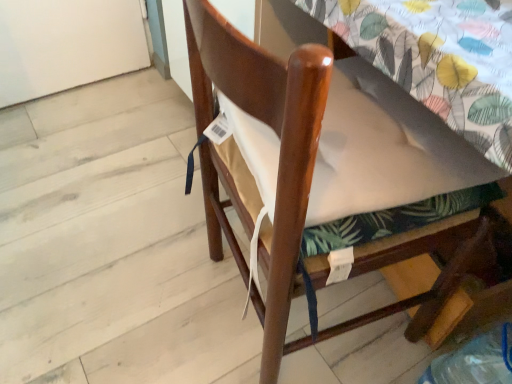
Locate an element on the screen. vacant area situated to the left side of matte brown chair at center is located at coordinates (x=147, y=284).